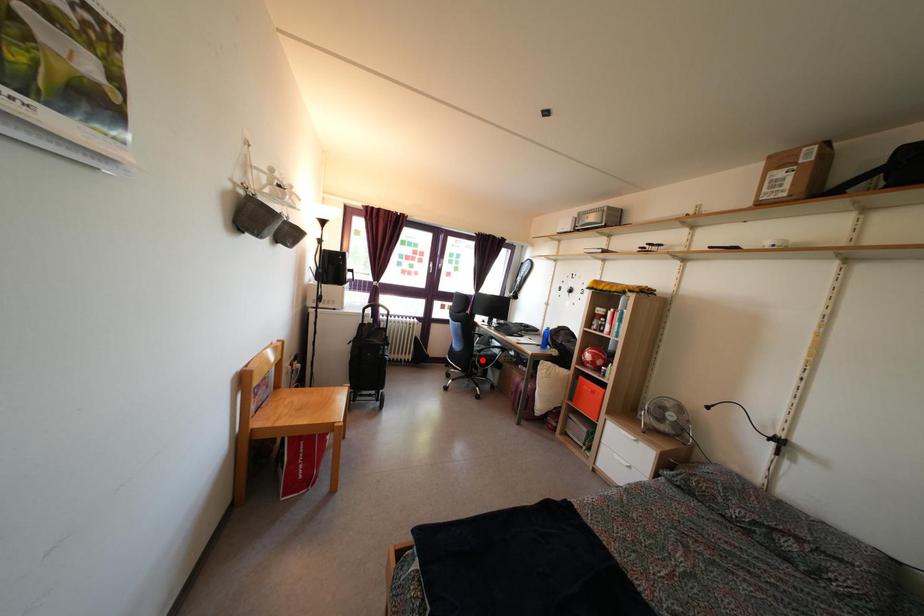
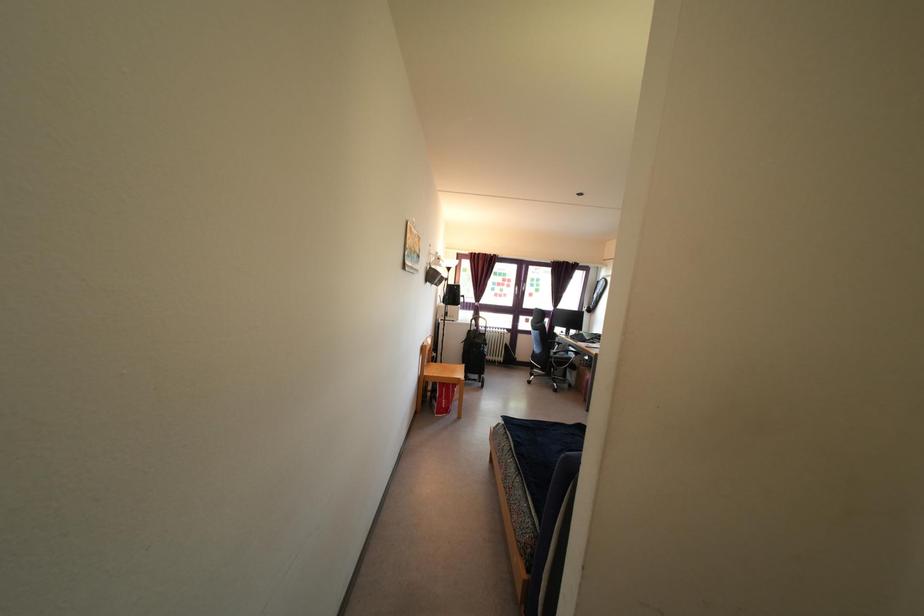
The point at the highlighted location is marked in the first image. Where is the corresponding point in the second image?

(557, 362)